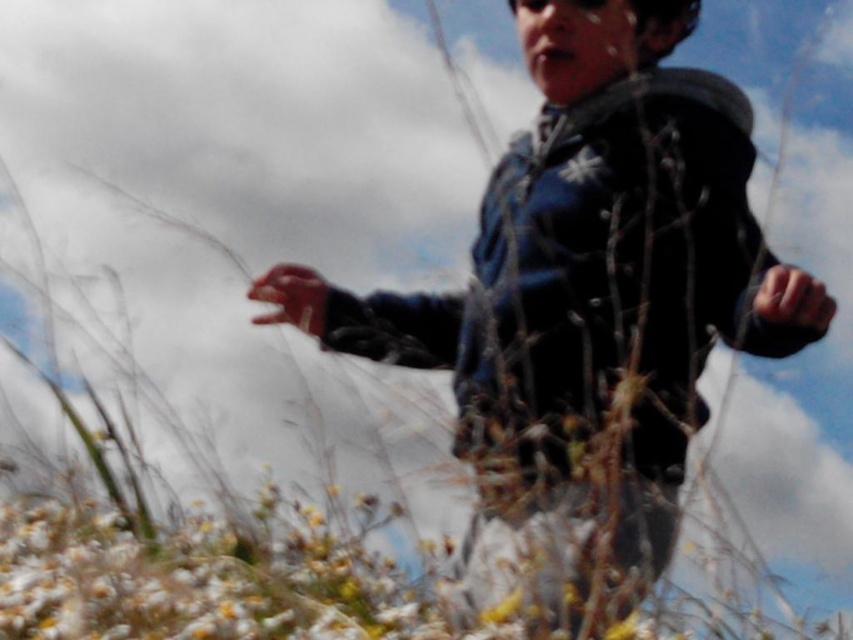
Question: Can you confirm if dark blue jacket at center is smaller than smooth skin hand at center?

Choices:
 (A) no
 (B) yes

Answer: (A)

Question: Is dark blue jacket at center below smooth skin hand at center?

Choices:
 (A) no
 (B) yes

Answer: (A)

Question: Which object is closer to the camera taking this photo?

Choices:
 (A) smooth skin hand at center
 (B) dark blue jacket at center

Answer: (B)

Question: Observing the image, what is the correct spatial positioning of dark blue jacket at center in reference to smooth skin hand at center?

Choices:
 (A) left
 (B) right

Answer: (B)